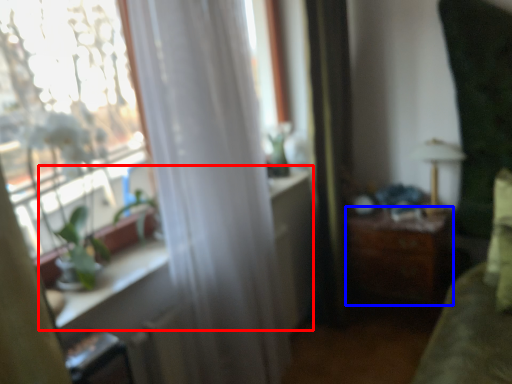
Question: Among these objects, which one is nearest to the camera, window sill (highlighted by a red box) or table (highlighted by a blue box)?

Choices:
 (A) window sill
 (B) table

Answer: (A)